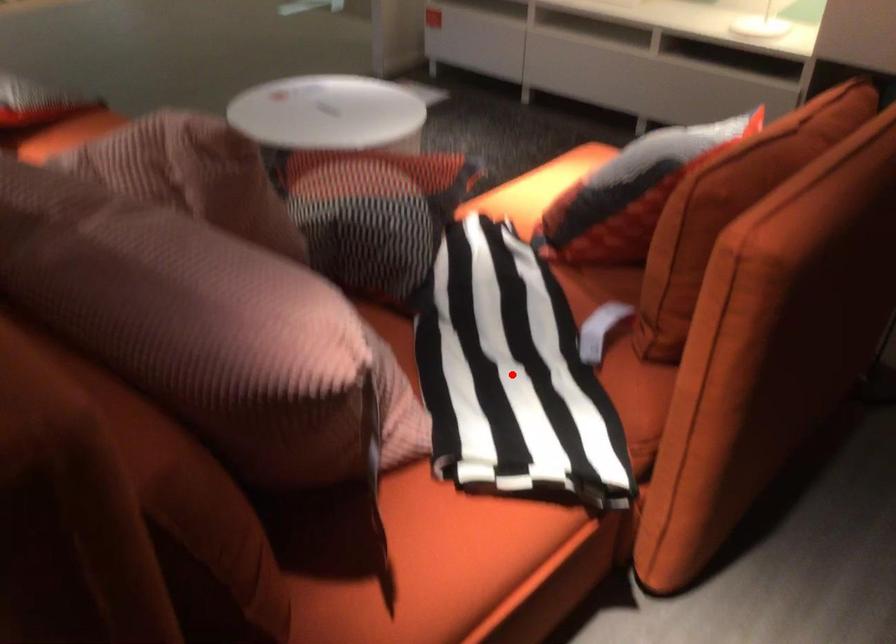
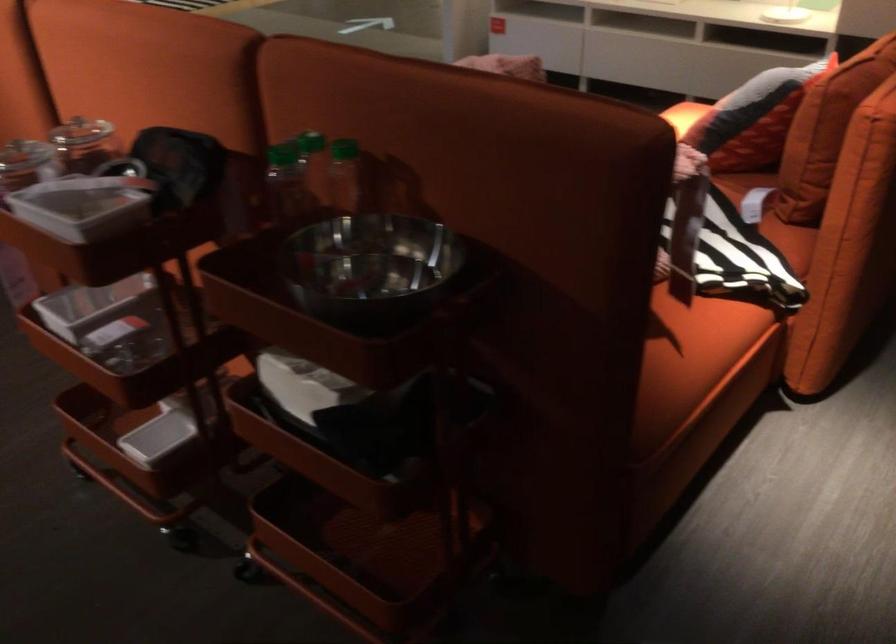
Find the pixel in the second image that matches the highlighted location in the first image.

(703, 231)